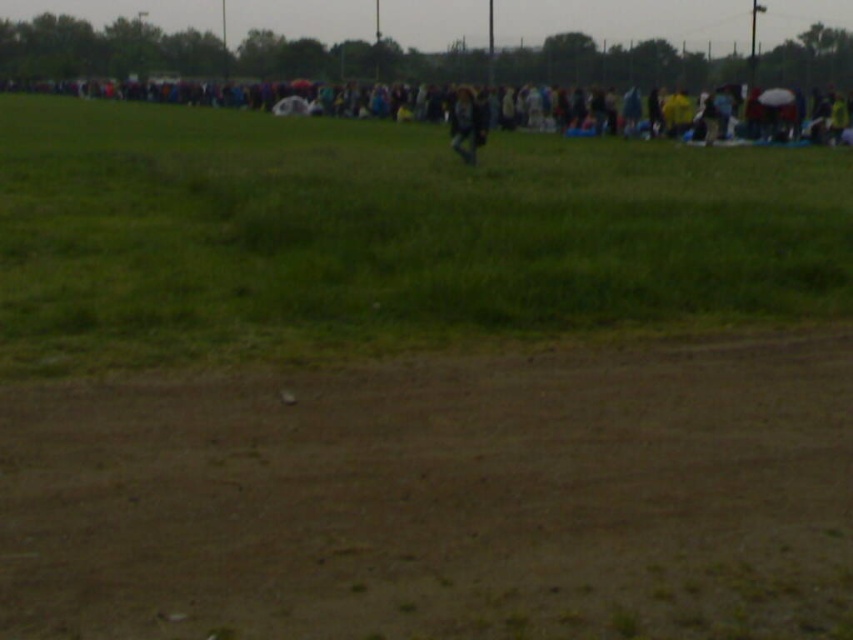
Image resolution: width=853 pixels, height=640 pixels. What are the coordinates of `brown dirt field at lower center` in the screenshot? It's located at (440, 499).

Can you confirm if green grass at upper center is bigger than dark blue jacket at center?

Correct, green grass at upper center is larger in size than dark blue jacket at center.

Is point (119, 186) in front of point (474, 132)?

Yes.

Where is `green grass at upper center`? Image resolution: width=853 pixels, height=640 pixels. green grass at upper center is located at coordinates (386, 236).

Locate an element on the screen. The width and height of the screenshot is (853, 640). green grass at upper center is located at coordinates (386, 236).

Which of these two, brown dirt field at lower center or dark blue jacket at center, stands shorter?

With less height is brown dirt field at lower center.

Is brown dirt field at lower center above dark blue jacket at center?

No.

Locate an element on the screen. The height and width of the screenshot is (640, 853). brown dirt field at lower center is located at coordinates (440, 499).

You are a GUI agent. You are given a task and a screenshot of the screen. Output one action in this format:
    pyautogui.click(x=<x>, y=<y>)
    Task: Click on the brown dirt field at lower center
    This screenshot has width=853, height=640.
    Given the screenshot: What is the action you would take?
    pyautogui.click(x=440, y=499)